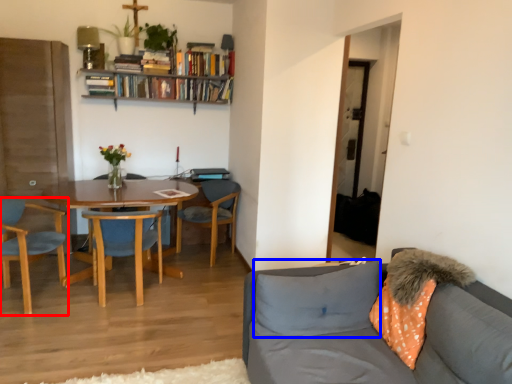
Question: Which object is further to the camera taking this photo, chair (highlighted by a red box) or pillow (highlighted by a blue box)?

Choices:
 (A) chair
 (B) pillow

Answer: (A)